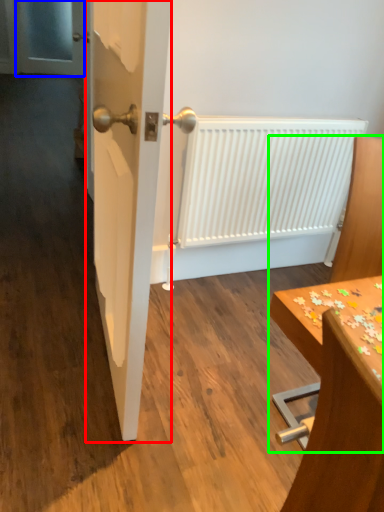
Question: Considering the real-world distances, which object is closest to door (highlighted by a red box)? screen door (highlighted by a blue box) or furniture (highlighted by a green box).

Choices:
 (A) screen door
 (B) furniture

Answer: (B)